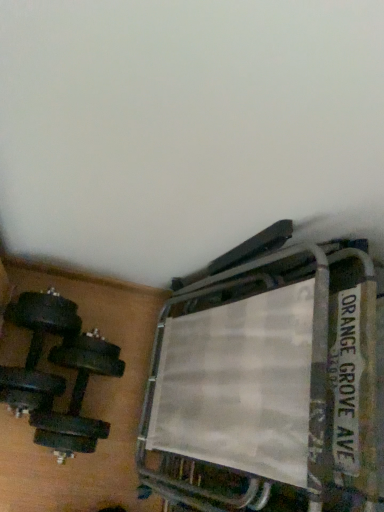
Question: From a real-world perspective, is black rubber dumbbell at lower left positioned above or below metallic silver bunk bed at upper right?

Choices:
 (A) above
 (B) below

Answer: (B)

Question: In terms of size, does black rubber dumbbell at lower left appear bigger or smaller than metallic silver bunk bed at upper right?

Choices:
 (A) small
 (B) big

Answer: (A)

Question: Considering their positions, is black rubber dumbbell at lower left located in front of or behind metallic silver bunk bed at upper right?

Choices:
 (A) front
 (B) behind

Answer: (B)

Question: Is metallic silver bunk bed at upper right in front of or behind black rubber dumbbell at lower left in the image?

Choices:
 (A) front
 (B) behind

Answer: (A)

Question: In terms of width, does metallic silver bunk bed at upper right look wider or thinner when compared to black rubber dumbbell at lower left?

Choices:
 (A) wide
 (B) thin

Answer: (B)

Question: Is metallic silver bunk bed at upper right taller or shorter than black rubber dumbbell at lower left?

Choices:
 (A) tall
 (B) short

Answer: (A)

Question: Based on their positions, is metallic silver bunk bed at upper right located to the left or right of black rubber dumbbell at lower left?

Choices:
 (A) left
 (B) right

Answer: (B)